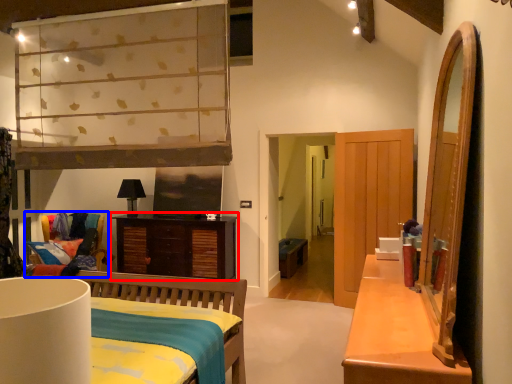
Question: Which object is closer to the camera taking this photo, cabinetry (highlighted by a red box) or chair (highlighted by a blue box)?

Choices:
 (A) cabinetry
 (B) chair

Answer: (B)